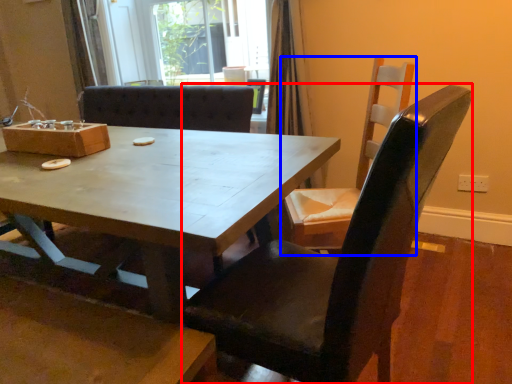
Question: Which object appears farthest to the camera in this image, chair (highlighted by a red box) or chair (highlighted by a blue box)?

Choices:
 (A) chair
 (B) chair

Answer: (B)